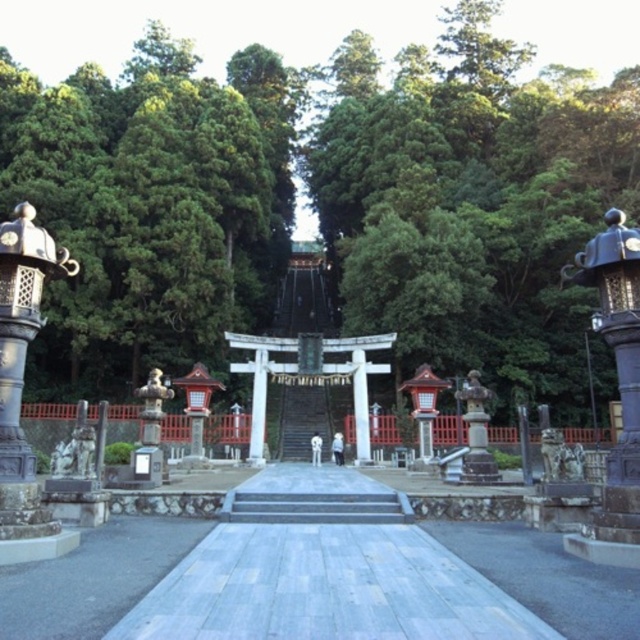
Question: Does green leafy tree at center have a greater width compared to wooden stairs at center?

Choices:
 (A) yes
 (B) no

Answer: (A)

Question: Based on their relative distances, which object is farther from the polished bronze lantern at right?

Choices:
 (A) green leafy tree at upper center
 (B) wooden stairs at center
 (C) green leafy tree at center

Answer: (A)

Question: Which point is closer to the camera?

Choices:
 (A) (385, 259)
 (B) (74, 365)
 (C) (636, 257)

Answer: (C)

Question: Which of the following is the closest to the observer?

Choices:
 (A) (296, 388)
 (B) (461, 67)

Answer: (A)

Question: Can you confirm if green leafy tree at upper center is positioned above wooden stairs at center?

Choices:
 (A) no
 (B) yes

Answer: (B)

Question: Is green leafy tree at upper center bigger than polished bronze lantern at right?

Choices:
 (A) yes
 (B) no

Answer: (A)